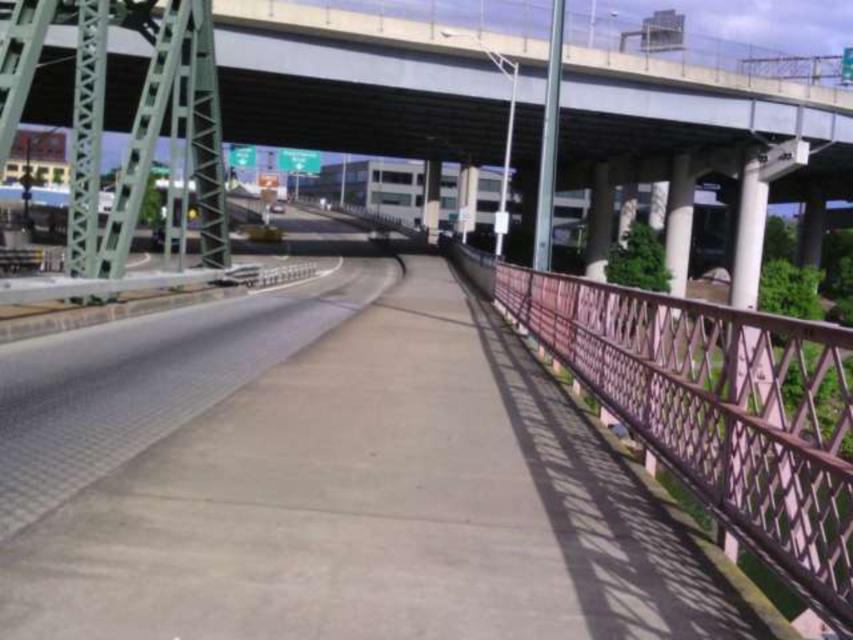
Which is below, concrete sidewalk at center or concrete bridge at upper center?

concrete sidewalk at center is below.

Where is `concrete sidewalk at center`? concrete sidewalk at center is located at coordinates point(376,508).

Is point (537, 451) positioned behind point (613, 140)?

No, it is in front of (613, 140).

The image size is (853, 640). I want to click on concrete sidewalk at center, so click(x=376, y=508).

Is concrete bridge at upper center to the right of pink metal railing at right from the viewer's perspective?

Incorrect, concrete bridge at upper center is not on the right side of pink metal railing at right.

Does concrete bridge at upper center come in front of pink metal railing at right?

No, it is not.

The image size is (853, 640). Find the location of `concrete bridge at upper center`. concrete bridge at upper center is located at coordinates (372, 83).

Between point (245, 509) and point (764, 432), which one is positioned behind?

Positioned behind is point (245, 509).

Which is above, concrete sidewalk at center or pink metal railing at right?

pink metal railing at right is higher up.

Locate an element on the screen. This screenshot has width=853, height=640. concrete sidewalk at center is located at coordinates (376, 508).